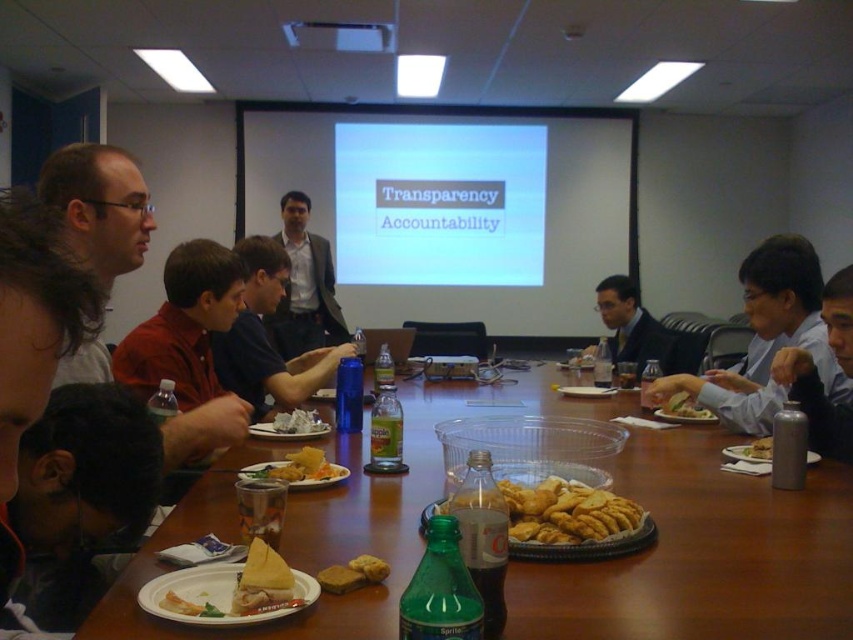
Question: Is matte plastic platter at lower center behind golden crisp pastry at center?

Choices:
 (A) yes
 (B) no

Answer: (B)

Question: Which object is closer to the camera taking this photo?

Choices:
 (A) blue plastic cup at center
 (B) brown crumbly cookie at center
 (C) golden crispy crackers at center

Answer: (C)

Question: Estimate the real-world distances between objects in this image. Which object is farther from the light blue shirt at center?

Choices:
 (A) white glossy projector screen at upper center
 (B) white matte projection screen at center
 (C) golden brown crumbly biscuit at center
 (D) white crumpled paper at center

Answer: (A)

Question: Is golden crispy chips at center positioned at the back of golden crispy bread at center?

Choices:
 (A) no
 (B) yes

Answer: (A)

Question: Which object is positioned farthest from the golden crispy chips at center?

Choices:
 (A) white matte projection screen at center
 (B) matte plastic platter at lower center

Answer: (A)

Question: Can you confirm if golden crisp pastry at center is smaller than golden brown crumbly biscuit at center?

Choices:
 (A) no
 (B) yes

Answer: (A)